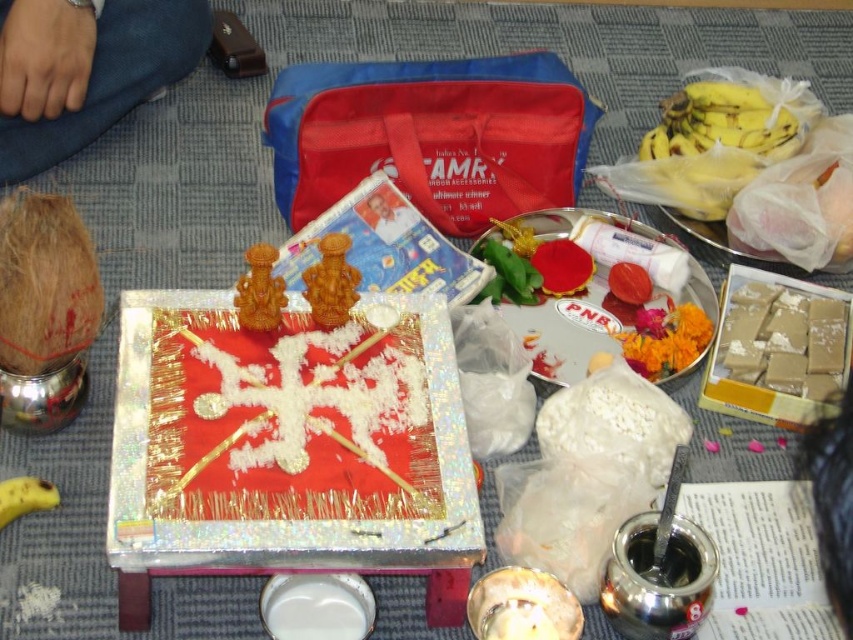
In the scene shown: You are standing in a room with a traditional Indian puja setup. You see the blue denim jeans at upper left and the yellow matte banana at lower left. Which object is closer to you?

The blue denim jeans at upper left is closer to you because it is in front of the yellow matte banana at lower left.